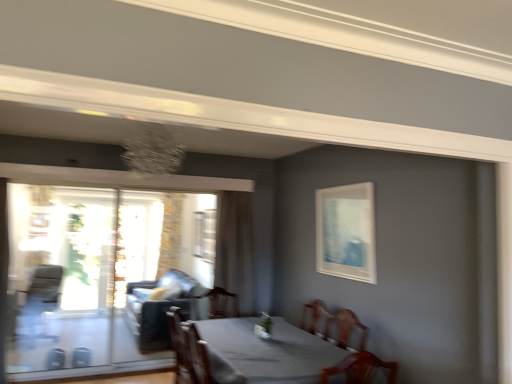
Question: Choose the correct answer: Is brown sheer curtain at center, the 1th curtain in the right-to-left sequence, inside transparent glass screen door at left or outside it?

Choices:
 (A) inside
 (B) outside

Answer: (B)

Question: Is point (222, 241) positioned closer to the camera than point (54, 249)?

Choices:
 (A) closer
 (B) farther

Answer: (A)

Question: Which object is positioned closest to the clear glass window at center, placed as the second window when sorted from left to right?

Choices:
 (A) suede-like dark gray couch at left
 (B) silky beige curtain at center, positioned as the 1th curtain in back-to-front order
 (C) smooth gray table at center
 (D) matte white picture frame at upper right
 (E) leather armchair at left, arranged as the 2th armchair when viewed from the right

Answer: (B)

Question: Estimate the real-world distances between objects in this image. Which object is farther from the dark brown leather armchair at center, which appears as the first armchair when viewed from the right?

Choices:
 (A) clear glass window at center, placed as the second window when sorted from left to right
 (B) suede-like dark gray couch at left
 (C) matte white picture frame at upper right
 (D) silky beige curtain at center, positioned as the 1th curtain in back-to-front order
 (E) leather armchair at left, which is counted as the 1th armchair, starting from the back

Answer: (D)